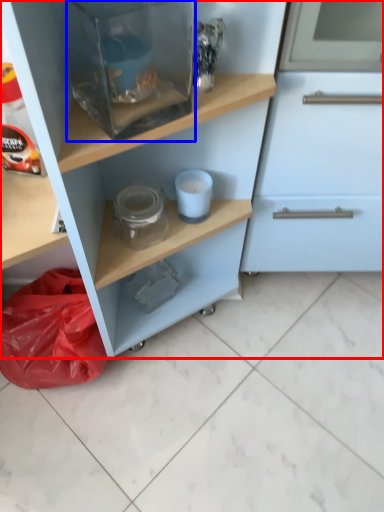
Question: Which point is closer to the camera, cupboard (highlighted by a red box) or appliance (highlighted by a blue box)?

Choices:
 (A) cupboard
 (B) appliance

Answer: (A)